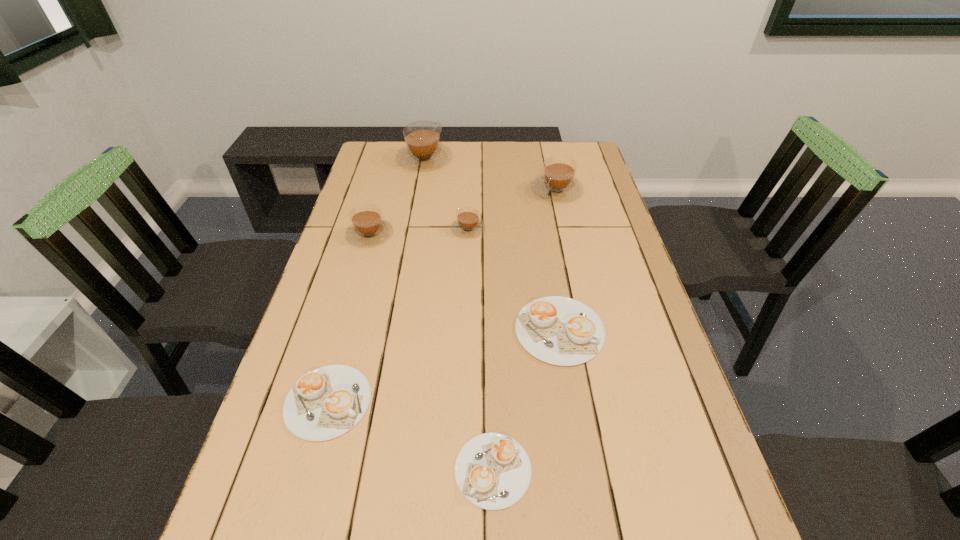
Locate an element on the screen. Image resolution: width=960 pixels, height=540 pixels. brown cappuccino identified as the third closest to the fourth shortest cappuccino is located at coordinates (423, 150).

Identify the location of the third closest white cappuccino to the second smallest brown cappuccino. (492, 470).

Point out which white cappuccino is positioned as the nearest to the shortest object. Please provide its 2D coordinates. Your answer should be formatted as a tuple, i.e. [(x, y)], where the tuple contains the x and y coordinates of a point satisfying the conditions above.

[(558, 330)]